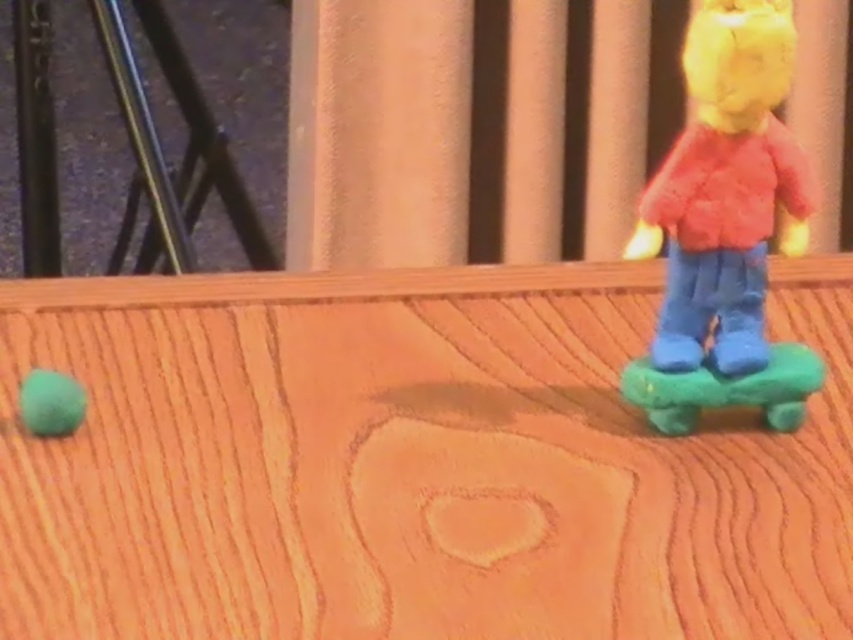
Is matte plastic toy at right shorter than green rubber skateboard at right?

In fact, matte plastic toy at right may be taller than green rubber skateboard at right.

Does matte plastic toy at right have a greater width compared to green rubber skateboard at right?

Yes.

Is point (743, 168) positioned after point (685, 387)?

No.

Find the location of a particular element. matte plastic toy at right is located at coordinates (726, 225).

Is point (711, 204) more distant than point (68, 381)?

No.

Which is below, matte plastic toy at right or matte green ball at left?

matte green ball at left is lower down.

The height and width of the screenshot is (640, 853). Find the location of `matte plastic toy at right`. matte plastic toy at right is located at coordinates (726, 225).

Find the location of a particular element. matte plastic toy at right is located at coordinates (726, 225).

From the picture: Between green rubber skateboard at right and matte green ball at left, which one appears on the left side from the viewer's perspective?

Positioned to the left is matte green ball at left.

Is green rubber skateboard at right positioned in front of matte green ball at left?

No, it is behind matte green ball at left.

Identify the location of green rubber skateboard at right. (724, 388).

This screenshot has width=853, height=640. In order to click on green rubber skateboard at right in this screenshot , I will do `click(724, 388)`.